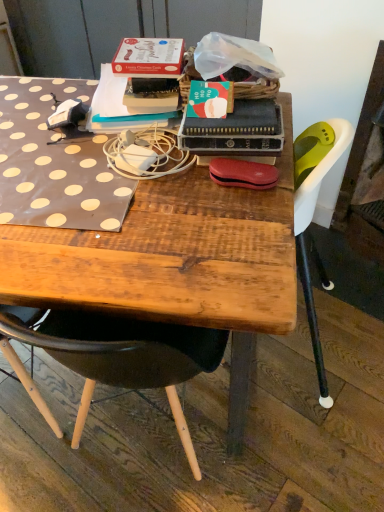
Find the location of a particular element. vacant point above wooden desk at center (from a real-world perspective) is located at coordinates (88, 160).